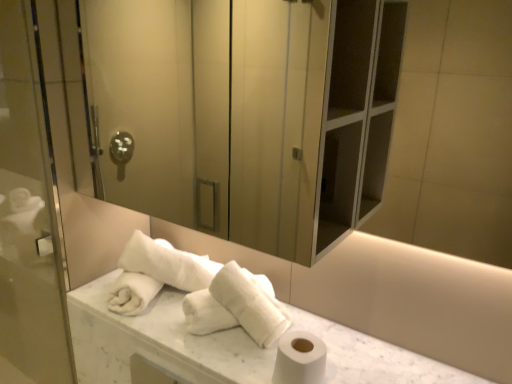
Question: Considering the positions of white matte toilet paper at lower right and white soft towel at center, which ranks as the 1th bath towel in left-to-right order, in the image, is white matte toilet paper at lower right taller or shorter than white soft towel at center, which ranks as the 1th bath towel in left-to-right order,?

Choices:
 (A) tall
 (B) short

Answer: (B)

Question: In terms of size, does white matte toilet paper at lower right appear bigger or smaller than white soft towel at center, the second bath towel from the right?

Choices:
 (A) big
 (B) small

Answer: (B)

Question: Which object is the farthest from the white soft towel at center, which ranks as the 1th bath towel in left-to-right order?

Choices:
 (A) transparent glass screen door at left, acting as the first screen door starting from the left
 (B) white matte toilet paper at lower right
 (C) white marble counter top at center
 (D) matte glass screen door at upper center, marked as the second screen door in a left-to-right arrangement
 (E) white fluffy towels at center, the 2th bath towel in the left-to-right sequence

Answer: (D)

Question: Estimate the real-world distances between objects in this image. Which object is farther from the matte glass screen door at upper center, marked as the second screen door in a left-to-right arrangement?

Choices:
 (A) transparent glass screen door at left, acting as the first screen door starting from the left
 (B) white soft towel at center, the second bath towel from the right
 (C) white matte toilet paper at lower right
 (D) white marble counter top at center
 (E) white fluffy towels at center, the 2th bath towel in the left-to-right sequence

Answer: (C)